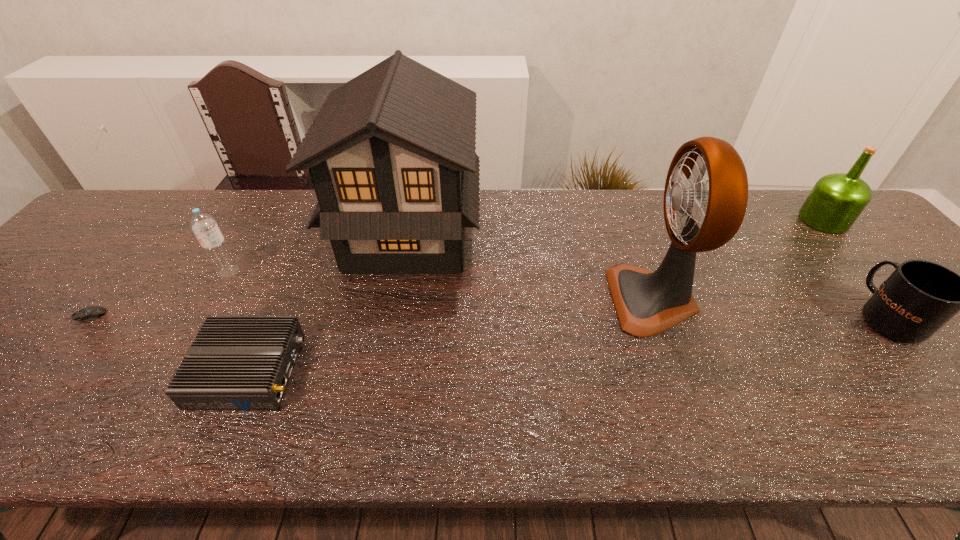
Locate an element on the screen. free space located 0.080m on the front-facing side of the third object from right to left is located at coordinates (580, 300).

Locate an element on the screen. The image size is (960, 540). blank area located 0.360m on the front-facing side of the third object from right to left is located at coordinates (465, 300).

Locate an element on the screen. Image resolution: width=960 pixels, height=540 pixels. free space located 0.300m on the front-facing side of the third object from right to left is located at coordinates (489, 300).

Find the location of a particular element. The image size is (960, 540). vacant area situated 0.310m on the left of the olive oil is located at coordinates (695, 220).

Where is `vacant area situated 0.170m on the front of the fourth shortest object`? Image resolution: width=960 pixels, height=540 pixels. vacant area situated 0.170m on the front of the fourth shortest object is located at coordinates (194, 333).

The height and width of the screenshot is (540, 960). Identify the location of blank space located 0.050m with the handle on the side of the fifth tallest object. (852, 275).

Find the location of `vacant space located with the handle on the side of the fifth tallest object`. vacant space located with the handle on the side of the fifth tallest object is located at coordinates (844, 265).

What are the coordinates of `free space located with the handle on the side of the fifth tallest object` in the screenshot? It's located at (799, 212).

I want to click on free location located 0.340m on the back panel of the second shortest object, so click(462, 370).

Find the location of a particular element. vacant space located on the left of the shortest object is located at coordinates (19, 316).